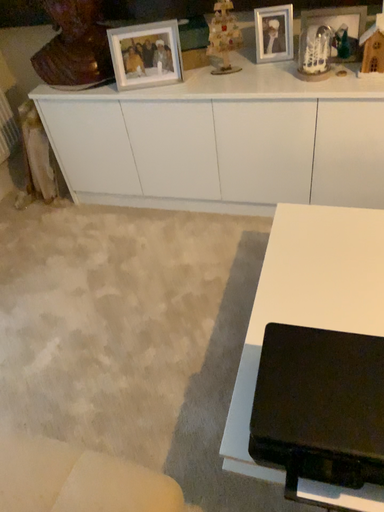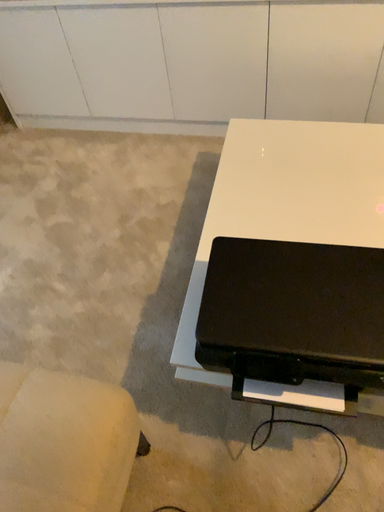
Question: Which way did the camera rotate in the video?

Choices:
 (A) rotated upward
 (B) rotated downward

Answer: (B)